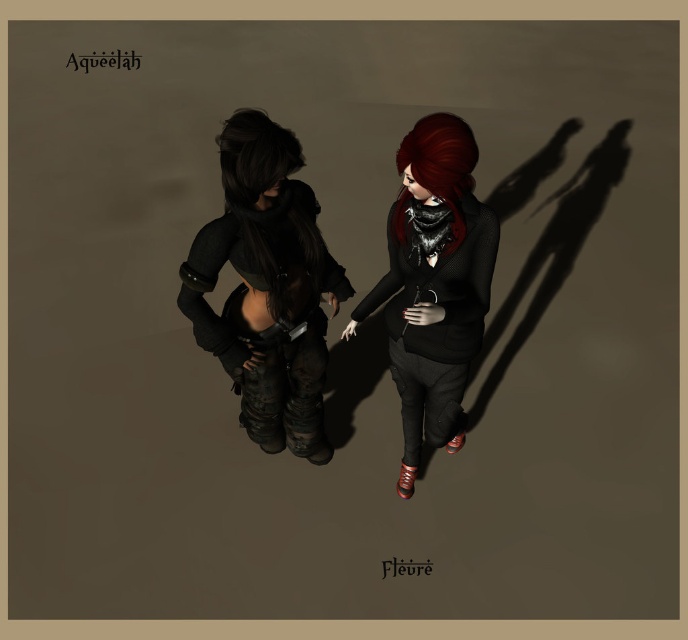
Question: Among these points, which one is farthest from the camera?

Choices:
 (A) (430, 419)
 (B) (270, 442)
 (C) (400, 202)

Answer: (B)

Question: Is matte black sweater at center further to camera compared to shiny black hair at center?

Choices:
 (A) no
 (B) yes

Answer: (A)

Question: Is shiny black hair at center bigger than shiny red hair at center?

Choices:
 (A) no
 (B) yes

Answer: (B)

Question: Can you confirm if matte black sweater at center is bigger than shiny black hair at center?

Choices:
 (A) yes
 (B) no

Answer: (A)

Question: Among these objects, which one is nearest to the camera?

Choices:
 (A) matte black jacket at center
 (B) shiny black hair at center
 (C) matte black sweater at center
 (D) shiny red hair at center

Answer: (D)

Question: Which point is closer to the camera?

Choices:
 (A) (424, 323)
 (B) (308, 253)

Answer: (A)